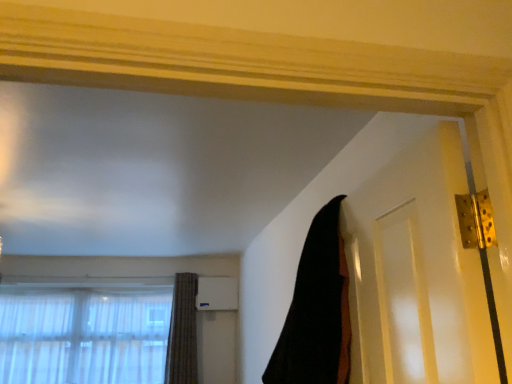
Question: Can you confirm if textured brown curtain at lower left, the first curtain when ordered from bottom to top, is positioned to the right of black fabric at upper right, the 1th curtain from the front?

Choices:
 (A) yes
 (B) no

Answer: (B)

Question: Is textured brown curtain at lower left, the second curtain from the front, outside of black fabric at upper right, marked as the 2th curtain in a bottom-to-top arrangement?

Choices:
 (A) yes
 (B) no

Answer: (A)

Question: Is textured brown curtain at lower left, the first curtain when ordered from bottom to top, shorter than black fabric at upper right, marked as the 2th curtain in a bottom-to-top arrangement?

Choices:
 (A) no
 (B) yes

Answer: (A)

Question: Is textured brown curtain at lower left, arranged as the 1th curtain when viewed from the left, smaller than black fabric at upper right, positioned as the first curtain in top-to-bottom order?

Choices:
 (A) no
 (B) yes

Answer: (B)

Question: Is textured brown curtain at lower left, which ranks as the second curtain in top-to-bottom order, turned away from black fabric at upper right, which is counted as the 2th curtain, starting from the back?

Choices:
 (A) no
 (B) yes

Answer: (A)

Question: Visually, is translucent fabric at lower left positioned to the left or to the right of black fabric at upper right, positioned as the first curtain in right-to-left order?

Choices:
 (A) left
 (B) right

Answer: (A)

Question: Is point (23, 324) closer or farther from the camera than point (327, 279)?

Choices:
 (A) farther
 (B) closer

Answer: (A)

Question: Based on their sizes in the image, would you say translucent fabric at lower left is bigger or smaller than black fabric at upper right, marked as the 2th curtain in a bottom-to-top arrangement?

Choices:
 (A) small
 (B) big

Answer: (B)

Question: Considering the positions of translucent fabric at lower left and black fabric at upper right, marked as the 2th curtain in a bottom-to-top arrangement, in the image, is translucent fabric at lower left taller or shorter than black fabric at upper right, marked as the 2th curtain in a bottom-to-top arrangement,?

Choices:
 (A) short
 (B) tall

Answer: (B)

Question: In terms of width, does textured brown curtain at lower left, arranged as the 1th curtain when viewed from the left, look wider or thinner when compared to black fabric at upper right, the 2th curtain viewed from the left?

Choices:
 (A) wide
 (B) thin

Answer: (B)

Question: Considering the relative positions of textured brown curtain at lower left, which ranks as the second curtain in top-to-bottom order, and black fabric at upper right, positioned as the first curtain in top-to-bottom order, in the image provided, is textured brown curtain at lower left, which ranks as the second curtain in top-to-bottom order, to the left or to the right of black fabric at upper right, positioned as the first curtain in top-to-bottom order,?

Choices:
 (A) left
 (B) right

Answer: (A)

Question: From the image's perspective, is textured brown curtain at lower left, which appears as the first curtain when viewed from the back, above or below black fabric at upper right, positioned as the first curtain in right-to-left order?

Choices:
 (A) above
 (B) below

Answer: (B)

Question: Is point (188, 357) positioned closer to the camera than point (321, 288)?

Choices:
 (A) farther
 (B) closer

Answer: (A)

Question: Considering the positions of black fabric at upper right, positioned as the first curtain in right-to-left order, and textured brown curtain at lower left, the first curtain when ordered from bottom to top, in the image, is black fabric at upper right, positioned as the first curtain in right-to-left order, taller or shorter than textured brown curtain at lower left, the first curtain when ordered from bottom to top,?

Choices:
 (A) tall
 (B) short

Answer: (B)

Question: From the image's perspective, is black fabric at upper right, the 1th curtain from the front, positioned above or below textured brown curtain at lower left, the first curtain when ordered from bottom to top?

Choices:
 (A) above
 (B) below

Answer: (A)